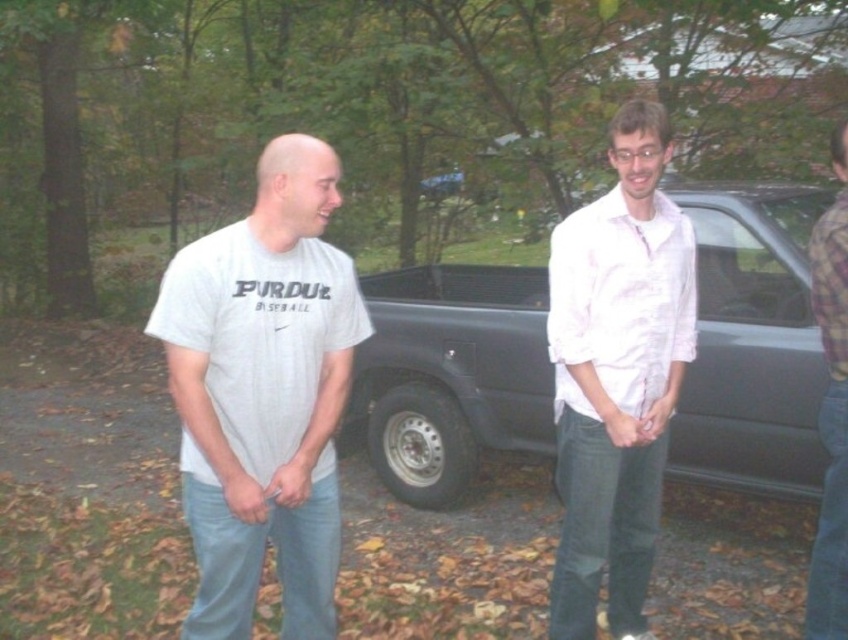
In the scene shown: You are standing 10 feet away from the camera. You want to take a photo of the white cotton shirt at center. Can you reach it without moving?

The white cotton shirt at center is 8.85 feet away from the camera. Since you are 10 feet away from the camera, you are farther than the shirt. To take the photo, you need to move closer to the shirt so that you are within its distance from the camera.

You are standing in the residential area and want to take a photo of the metallic gray truck at center and the white cotton shirt at center. Which object should you focus on first to ensure both are in clear view?

You should focus on the metallic gray truck at center first because it is closer to you than the white cotton shirt at center, ensuring both will be in clear view when focused properly.